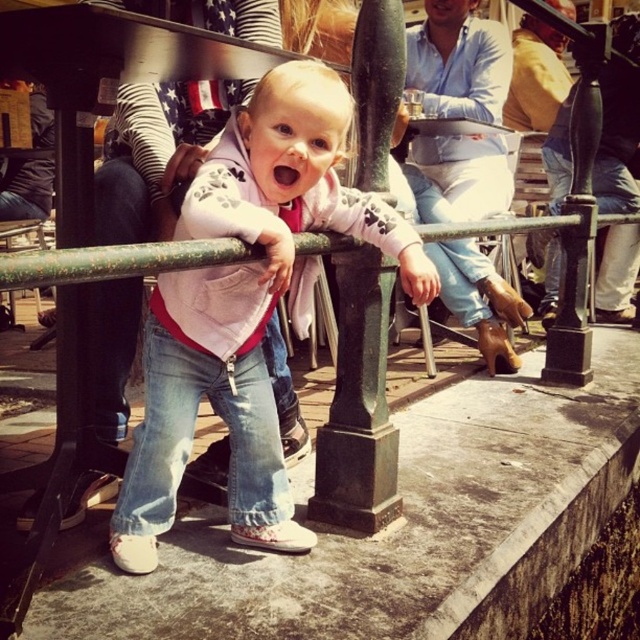
Question: From the image, what is the correct spatial relationship of white matte jacket at center in relation to matte blue jeans at center?

Choices:
 (A) above
 (B) below

Answer: (B)

Question: Among these objects, which one is nearest to the camera?

Choices:
 (A) white matte jacket at center
 (B) matte blue jeans at center

Answer: (A)

Question: Is white matte jacket at center to the left of matte blue jeans at center from the viewer's perspective?

Choices:
 (A) no
 (B) yes

Answer: (B)

Question: Can you confirm if white matte jacket at center is positioned to the left of matte blue jeans at center?

Choices:
 (A) no
 (B) yes

Answer: (B)